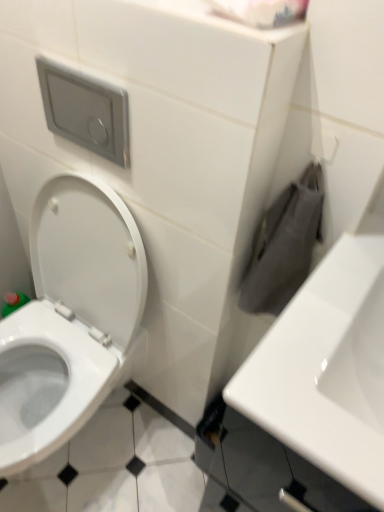
This screenshot has width=384, height=512. What do you see at coordinates (262, 11) in the screenshot?
I see `white matte toilet paper at upper center` at bounding box center [262, 11].

You are a GUI agent. You are given a task and a screenshot of the screen. Output one action in this format:
    pyautogui.click(x=<x>, y=<y>)
    Task: Click on the white glossy sink at right
    The height and width of the screenshot is (512, 384).
    Given the screenshot: What is the action you would take?
    [x=327, y=369]

Is white glossy toilet at left inside white glossy sink at right?

Actually, white glossy toilet at left is outside white glossy sink at right.

Could you tell me if white glossy sink at right is turned towards white glossy toilet at left?

No, white glossy sink at right is not turned towards white glossy toilet at left.

This screenshot has width=384, height=512. Find the location of `sink in front of the white glossy toilet at left`. sink in front of the white glossy toilet at left is located at coordinates (327, 369).

From the image's perspective, between white glossy sink at right and white glossy toilet at left, who is located below?

white glossy toilet at left is shown below in the image.

Between white glossy sink at right and white matte toilet paper at upper center, which one is positioned in front?

white glossy sink at right is in front.

Could you tell me if white glossy sink at right is turned towards white matte toilet paper at upper center?

No, white glossy sink at right is not oriented towards white matte toilet paper at upper center.

You are a GUI agent. You are given a task and a screenshot of the screen. Output one action in this format:
    pyautogui.click(x=<x>, y=<y>)
    Task: Click on the toilet paper above the white glossy sink at right (from the image's perspective)
    
    Given the screenshot: What is the action you would take?
    pyautogui.click(x=262, y=11)

Does white glossy sink at right have a lesser width compared to white matte toilet paper at upper center?

Incorrect, the width of white glossy sink at right is not less than that of white matte toilet paper at upper center.

How many degrees apart are the facing directions of white matte toilet paper at upper center and white glossy toilet at left?

The angular difference between white matte toilet paper at upper center and white glossy toilet at left is 5.66e-05 degrees.

Considering the positions of points (281, 8) and (15, 362), is point (281, 8) farther from camera compared to point (15, 362)?

No, it is not.

Is white matte toilet paper at upper center to the left of white glossy toilet at left from the viewer's perspective?

In fact, white matte toilet paper at upper center is to the right of white glossy toilet at left.

Is white glossy toilet at left at the back of white matte toilet paper at upper center?

No, white glossy toilet at left is not at the back of white matte toilet paper at upper center.

Between white glossy toilet at left and white glossy sink at right, which one has less height?

white glossy sink at right.

Is white glossy toilet at left oriented away from white glossy sink at right?

No, white glossy toilet at left's orientation is not away from white glossy sink at right.

Where is `toilet on the left of the white glossy sink at right`? The height and width of the screenshot is (512, 384). toilet on the left of the white glossy sink at right is located at coordinates (71, 319).

Is white matte toilet paper at upper center at the back of white glossy toilet at left?

white glossy toilet at left does not have its back to white matte toilet paper at upper center.

In terms of width, does white glossy toilet at left look wider or thinner when compared to white matte toilet paper at upper center?

Clearly, white glossy toilet at left has more width compared to white matte toilet paper at upper center.

Does point (64, 201) come in front of point (306, 8)?

No, it is not.

Who is more distant, white matte toilet paper at upper center or white glossy sink at right?

white matte toilet paper at upper center is behind.

Is white matte toilet paper at upper center oriented away from white glossy sink at right?

No.

Can you confirm if white matte toilet paper at upper center is wider than white glossy sink at right?

No.

Are white matte toilet paper at upper center and white glossy sink at right making contact?

No, white matte toilet paper at upper center is not next to white glossy sink at right.

This screenshot has height=512, width=384. I want to click on sink above the white glossy toilet at left (from the image's perspective), so click(x=327, y=369).

Identify the location of toilet paper lying behind the white glossy sink at right. (262, 11).

From the picture: When comparing their distances from white glossy sink at right, does white glossy toilet at left or white matte toilet paper at upper center seem further?

white glossy toilet at left is further to white glossy sink at right.

Considering their positions, is white matte toilet paper at upper center positioned closer to white glossy toilet at left than white glossy sink at right?

white glossy sink at right lies closer to white glossy toilet at left than the other object.

Estimate the real-world distances between objects in this image. Which object is closer to white glossy toilet at left, white glossy sink at right or white matte toilet paper at upper center?

white glossy sink at right is positioned closer to the anchor white glossy toilet at left.

Based on their spatial positions, is white glossy toilet at left or white glossy sink at right closer to white matte toilet paper at upper center?

white glossy sink at right.

Which object lies nearer to the anchor point white matte toilet paper at upper center, white glossy sink at right or white glossy toilet at left?

white glossy sink at right lies closer to white matte toilet paper at upper center than the other object.

Which object lies further to the anchor point white glossy sink at right, white matte toilet paper at upper center or white glossy toilet at left?

The object further to white glossy sink at right is white glossy toilet at left.

Locate an element on the screen. This screenshot has width=384, height=512. sink that lies between white matte toilet paper at upper center and white glossy toilet at left from top to bottom is located at coordinates (327, 369).